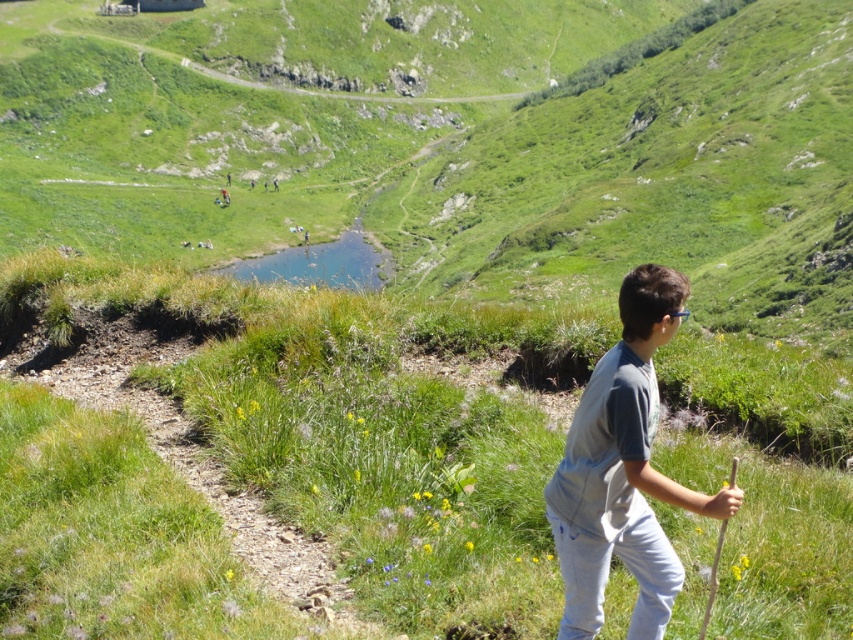
You are a hiker who wants to take a photo of the gray cotton shirt at center and the green grassy at center. Which object should you focus on first if you want the one closer to you to be sharp?

The gray cotton shirt at center is closer to you than the green grassy at center, so you should focus on the gray cotton shirt at center first to ensure it is sharp.

You are a hiker on the path and want to take a photo of the gray cotton shirt at center without the green grassy at center in the background. Is it possible to do so?

The gray cotton shirt at center is behind the green grassy at center, so you cannot take a photo of the gray cotton shirt at center without the green grassy at center in the background.

You are standing at the point with coordinates point (598, 419) and want to walk towards the point with coordinates point (668, 385). Which direction should you move relative to your current position?

You should move towards the point (668, 385) by going north because it is further to the viewer than point (598, 419).